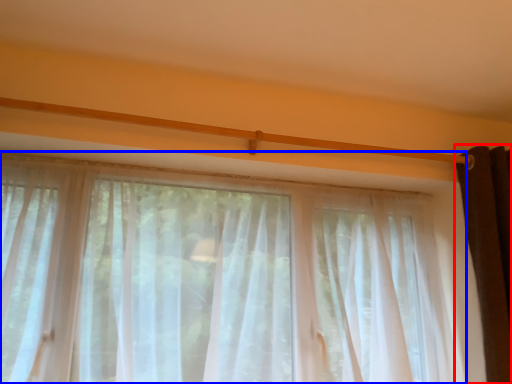
Question: Among these objects, which one is nearest to the camera, curtain (highlighted by a red box) or curtain (highlighted by a blue box)?

Choices:
 (A) curtain
 (B) curtain

Answer: (B)